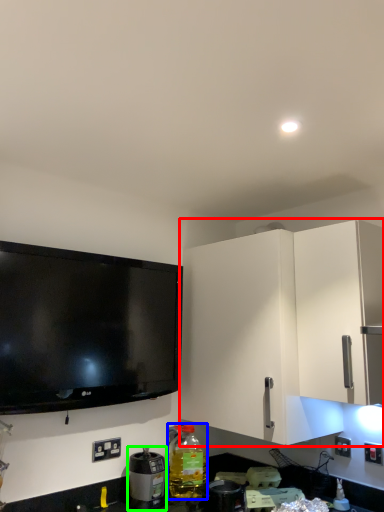
Question: Which object is the closest to the cabinetry (highlighted by a red box)? Choose among these: bottle (highlighted by a blue box) or appliance (highlighted by a green box).

Choices:
 (A) bottle
 (B) appliance

Answer: (A)